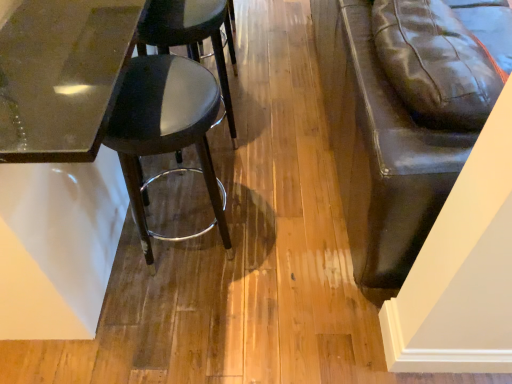
This screenshot has height=384, width=512. Find the location of `free point above matte black stool at left, which is the first stool from bottom to top (from a real-world perspective)`. free point above matte black stool at left, which is the first stool from bottom to top (from a real-world perspective) is located at coordinates (150, 84).